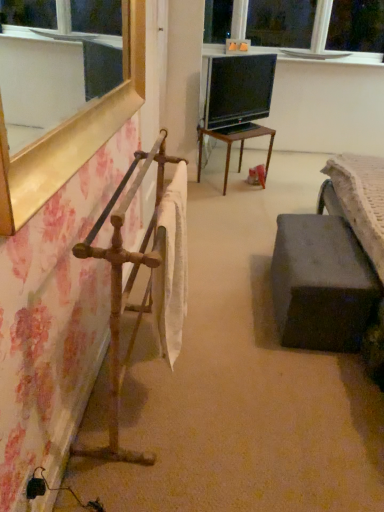
This screenshot has width=384, height=512. Find the location of `vacant space underneath rusty metal towel rack at left (from a real-world perspective)`. vacant space underneath rusty metal towel rack at left (from a real-world perspective) is located at coordinates (135, 397).